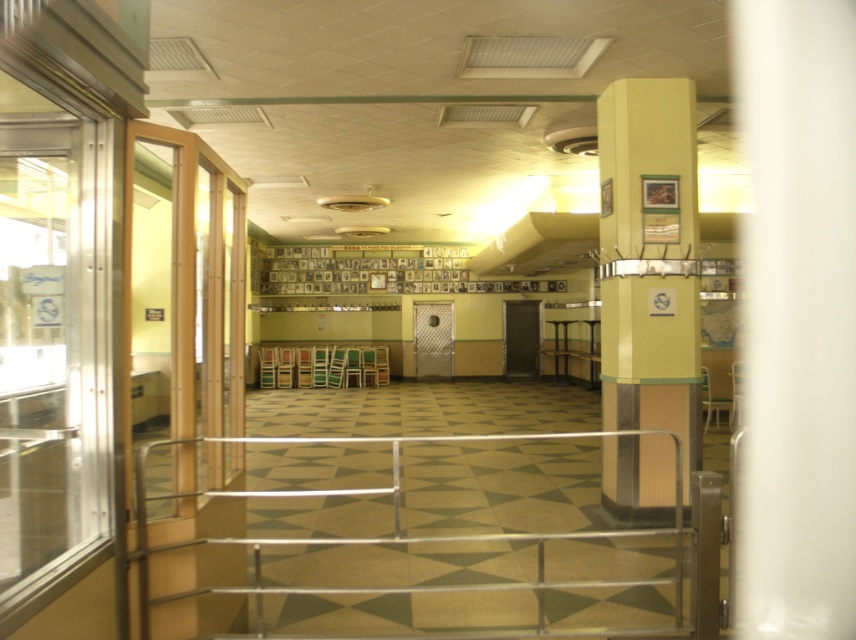
Question: Is silver metallic rail at center positioned before yellow matte column at center?

Choices:
 (A) yes
 (B) no

Answer: (A)

Question: Which point is closer to the camera?

Choices:
 (A) (637, 403)
 (B) (408, 627)

Answer: (B)

Question: Which object is closer to the camera taking this photo?

Choices:
 (A) silver metallic rail at center
 (B) yellow matte column at center

Answer: (A)

Question: Is silver metallic rail at center further to camera compared to yellow matte column at center?

Choices:
 (A) no
 (B) yes

Answer: (A)

Question: Is silver metallic rail at center closer to the viewer compared to yellow matte column at center?

Choices:
 (A) yes
 (B) no

Answer: (A)